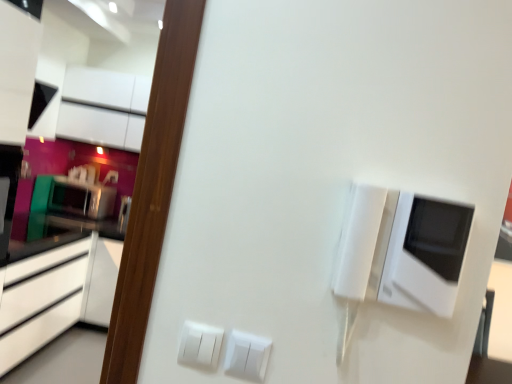
Question: Is satin black microwave at left, the second appliance from the right, facing towards matte black cabinet at upper left, arranged as the 1th cabinetry when viewed from the top?

Choices:
 (A) yes
 (B) no

Answer: (B)

Question: Is satin black microwave at left, the second appliance from the right, in front of matte black cabinet at upper left, the 3th cabinetry positioned from the bottom?

Choices:
 (A) no
 (B) yes

Answer: (A)

Question: Does satin black microwave at left, the second appliance from the right, have a lesser height compared to matte black cabinet at upper left, the 3th cabinetry positioned from the bottom?

Choices:
 (A) yes
 (B) no

Answer: (A)

Question: Is satin black microwave at left, the second appliance from the right, taller than matte black cabinet at upper left, the 3th cabinetry positioned from the bottom?

Choices:
 (A) no
 (B) yes

Answer: (A)

Question: From the image's perspective, is satin black microwave at left, the second appliance from the right, beneath matte black cabinet at upper left, arranged as the 1th cabinetry when viewed from the top?

Choices:
 (A) yes
 (B) no

Answer: (A)

Question: Is white plastic switch at lower center, the first electric outlet viewed from the left, taller or shorter than white plastic switch at lower center, the first electric outlet positioned from the right?

Choices:
 (A) tall
 (B) short

Answer: (A)

Question: From the image's perspective, is white plastic switch at lower center, marked as the 2th electric outlet in a right-to-left arrangement, located above or below white plastic switch at lower center, the first electric outlet positioned from the right?

Choices:
 (A) below
 (B) above

Answer: (B)

Question: Is white plastic switch at lower center, the first electric outlet viewed from the left, bigger or smaller than white plastic switch at lower center, placed as the 2th electric outlet when sorted from left to right?

Choices:
 (A) big
 (B) small

Answer: (A)

Question: Considering the positions of point (196, 357) and point (251, 365), is point (196, 357) closer or farther from the camera than point (251, 365)?

Choices:
 (A) closer
 (B) farther

Answer: (B)

Question: From the image's perspective, is white glossy microwave at upper right, the first appliance positioned from the front, positioned above or below matte black cabinet at upper left, arranged as the 1th cabinetry when viewed from the top?

Choices:
 (A) above
 (B) below

Answer: (B)

Question: Looking at the image, does white glossy microwave at upper right, the 2th appliance in the back-to-front sequence, seem bigger or smaller compared to matte black cabinet at upper left, arranged as the 1th cabinetry when viewed from the top?

Choices:
 (A) small
 (B) big

Answer: (A)

Question: Based on their positions, is white glossy microwave at upper right, which appears as the 2th appliance when viewed from the left, located to the left or right of matte black cabinet at upper left, the 3th cabinetry positioned from the bottom?

Choices:
 (A) left
 (B) right

Answer: (B)

Question: Is white glossy microwave at upper right, the first appliance positioned from the front, in front of or behind matte black cabinet at upper left, arranged as the 1th cabinetry when viewed from the top, in the image?

Choices:
 (A) behind
 (B) front

Answer: (B)

Question: From a real-world perspective, is white glossy cabinetry at upper left, which is the second cabinetry in bottom-to-top order, above or below satin black microwave at left, the second appliance from the right?

Choices:
 (A) below
 (B) above

Answer: (B)

Question: Based on their sizes in the image, would you say white glossy cabinetry at upper left, which is the second cabinetry in bottom-to-top order, is bigger or smaller than satin black microwave at left, the second appliance from the right?

Choices:
 (A) small
 (B) big

Answer: (B)